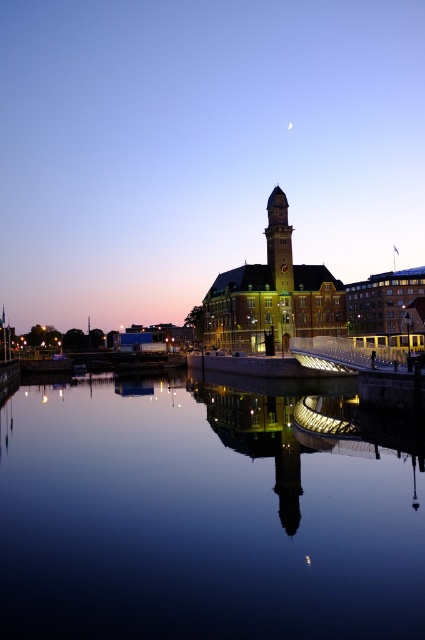
You are standing at the center of the waterfront scene and want to reach the smooth glass water at center. In which direction should you move to get there?

The smooth glass water at center is located at point (200, 518), so you should move towards the center of the waterfront scene to reach it.

You are standing at the waterfront and want to take a photo of both the smooth glass water at center and the golden stone clock tower at center. Which object will appear larger in the photo?

The smooth glass water at center will appear larger in the photo because it is closer to the viewer than the golden stone clock tower at center.